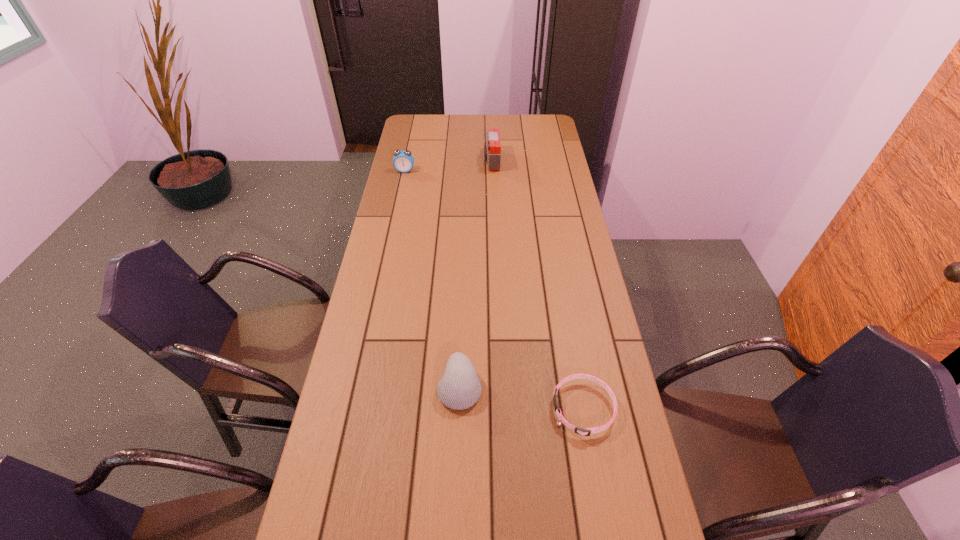
At what (x,y) coordinates should I click in order to perform the action: click on object that stands as the second closest to the second object from left to right. Please return your answer as a coordinate pair (x, y). Image resolution: width=960 pixels, height=540 pixels. Looking at the image, I should click on (492, 148).

The height and width of the screenshot is (540, 960). I want to click on free space in the image that satisfies the following two spatial constraints: 1. on the face of the beanie; 2. on the left side of the leftmost object, so click(358, 387).

Locate an element on the screen. blank area in the image that satisfies the following two spatial constraints: 1. on the front-facing side of the tallest object; 2. on the face of the leftmost object is located at coordinates (492, 171).

At what (x,y) coordinates should I click in order to perform the action: click on vacant space that satisfies the following two spatial constraints: 1. on the face of the beanie; 2. on the right side of the alarm clock. Please return your answer as a coordinate pair (x, y). Looking at the image, I should click on (358, 387).

The image size is (960, 540). What are the coordinates of `free space that satisfies the following two spatial constraints: 1. on the front-facing side of the tallest object; 2. on the face of the alarm clock` in the screenshot? It's located at (492, 171).

The image size is (960, 540). Identify the location of vacant area in the image that satisfies the following two spatial constraints: 1. on the front-facing side of the tallest object; 2. on the face of the alarm clock. (492, 171).

The height and width of the screenshot is (540, 960). What are the coordinates of `free location that satisfies the following two spatial constraints: 1. on the front-facing side of the camera; 2. on the face of the leftmost object` in the screenshot? It's located at (492, 171).